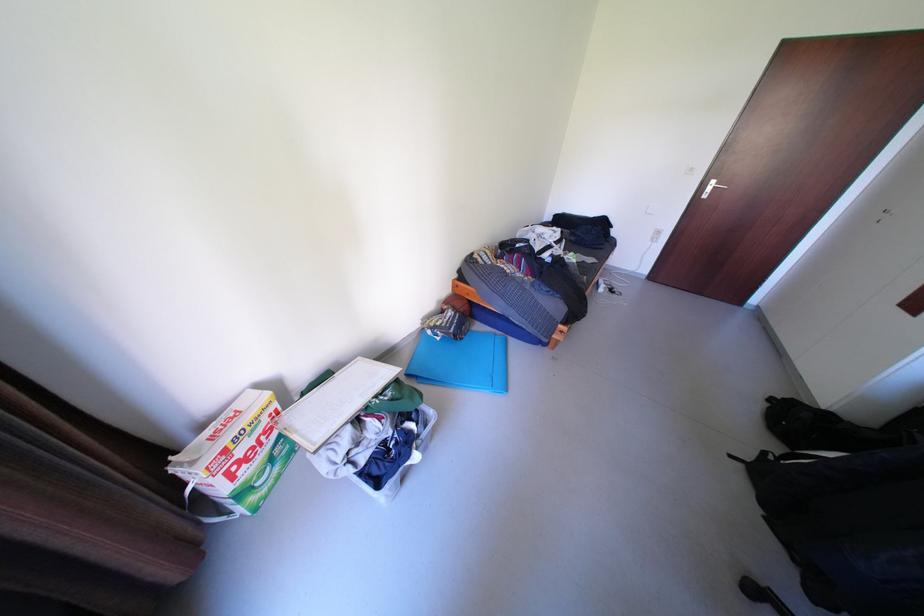
Where is `silver door handle`? This screenshot has width=924, height=616. silver door handle is located at coordinates (711, 188).